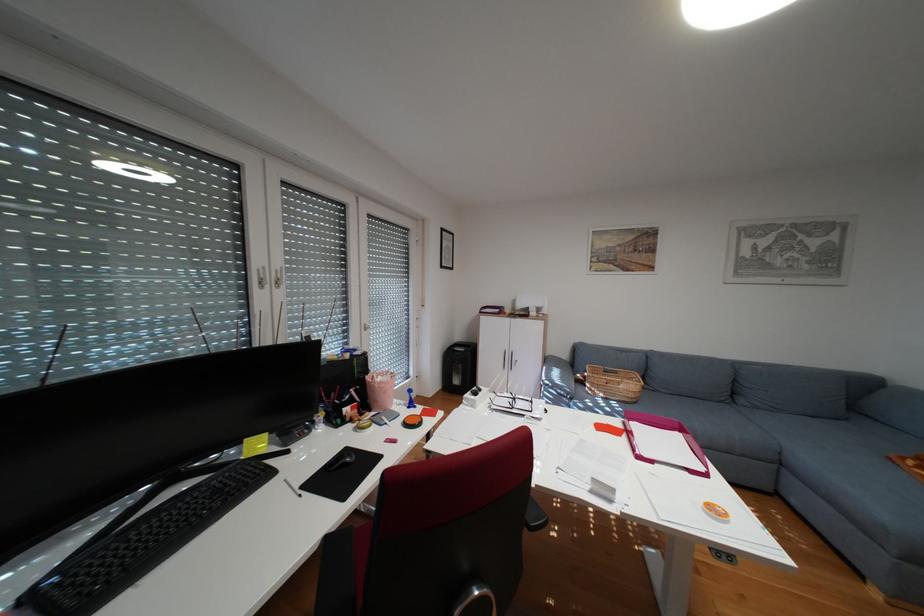
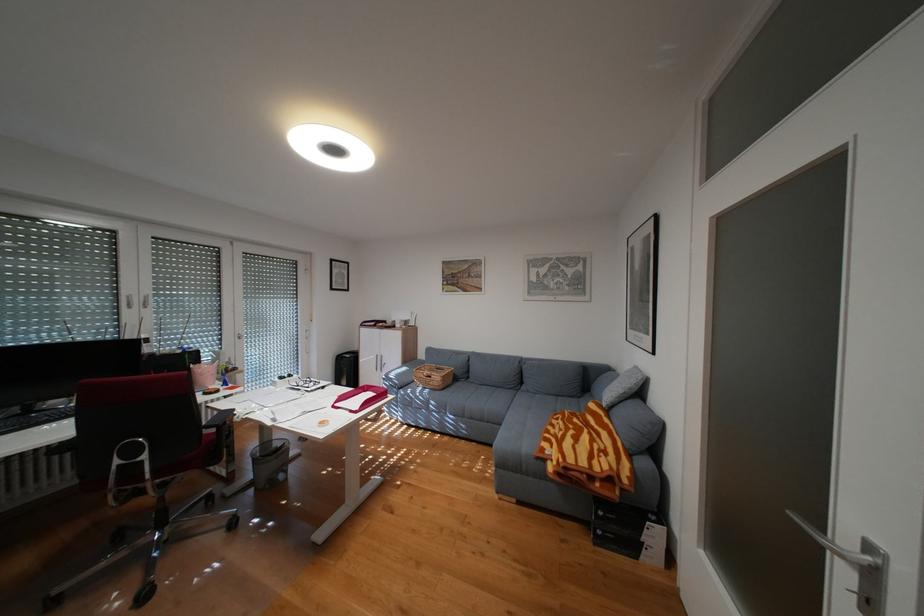
The point at (641, 386) is marked in the first image. Where is the corresponding point in the second image?

(450, 377)